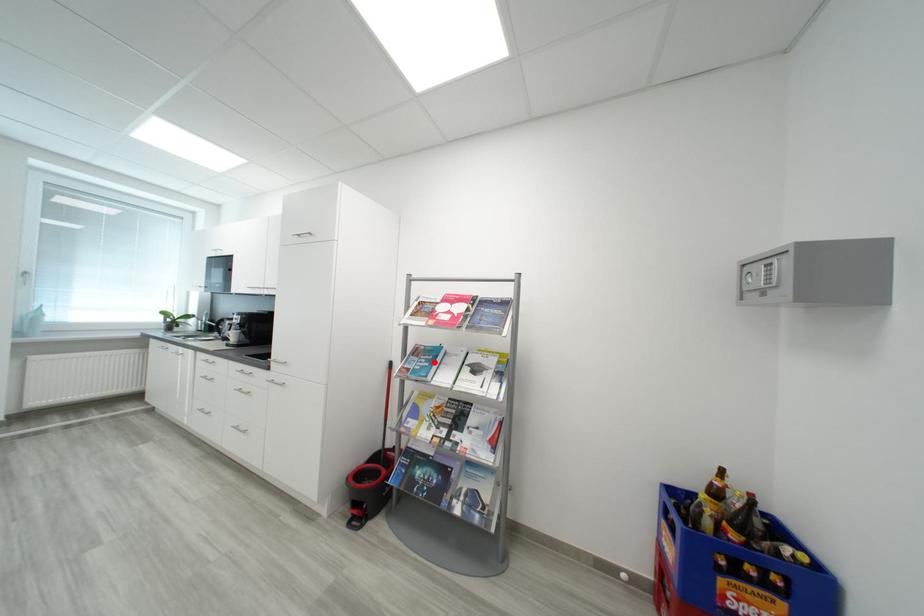
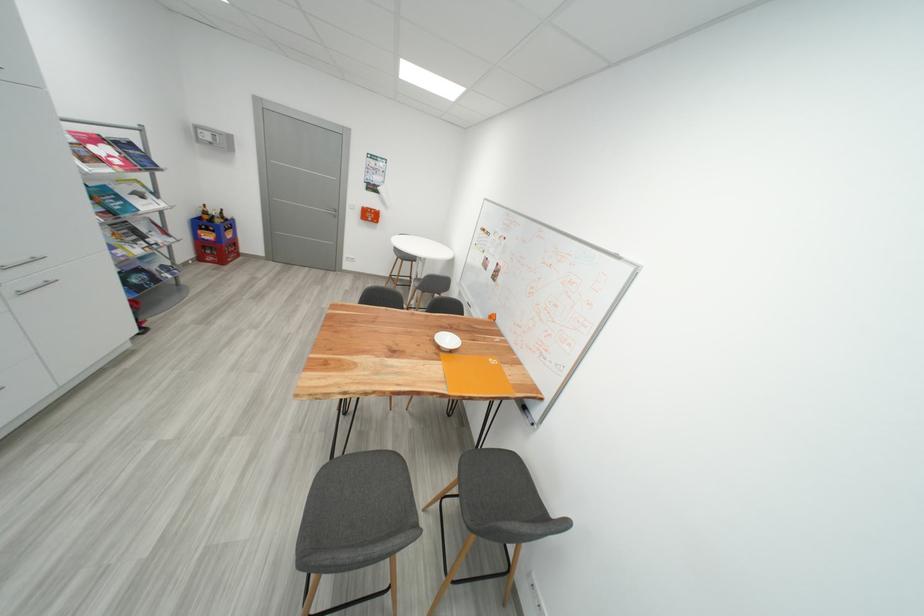
The point at the highlighted location is marked in the first image. Where is the corresponding point in the second image?

(122, 201)